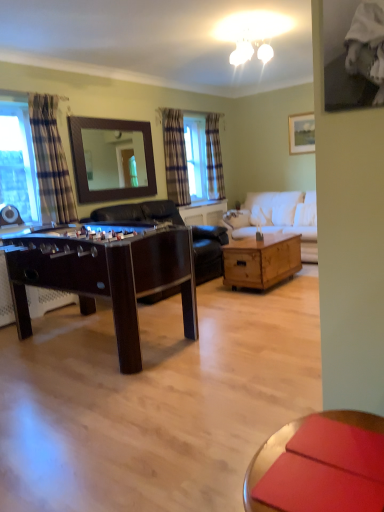
Find the location of a particular element. vacant region above smooth wooden coffee table at lower right (from a real-world perspective) is located at coordinates tap(318, 486).